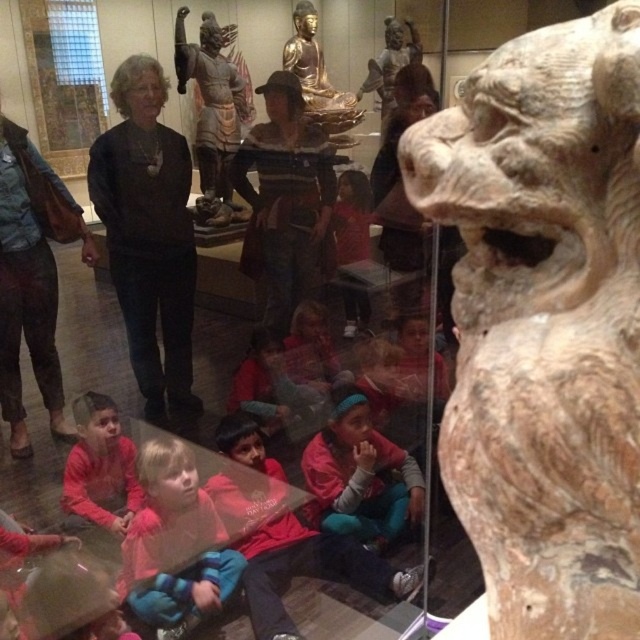
Which is above, pink fabric at center or matte red shirt at lower left?

matte red shirt at lower left is above.

Between point (404, 513) and point (115, 497), which one is positioned in front?

Positioned in front is point (115, 497).

You are a GUI agent. You are given a task and a screenshot of the screen. Output one action in this format:
    pyautogui.click(x=<x>, y=<y>)
    Task: Click on the pink fabric at center
    The image size is (640, 640).
    Given the screenshot: What is the action you would take?
    pyautogui.click(x=358, y=476)

Can you confirm if dark brown sweater at center is taller than light pink fleece jacket at lower center?

Indeed, dark brown sweater at center has a greater height compared to light pink fleece jacket at lower center.

Is dark brown sweater at center thinner than light pink fleece jacket at lower center?

Indeed, dark brown sweater at center has a lesser width compared to light pink fleece jacket at lower center.

Who is more distant from viewer, (92, 152) or (163, 456)?

Positioned behind is point (92, 152).

Image resolution: width=640 pixels, height=640 pixels. I want to click on dark brown sweater at center, so click(x=148, y=234).

Between pink fabric at center and gold metallic statue at upper center, which one appears on the right side from the viewer's perspective?

pink fabric at center

Is point (368, 525) in front of point (230, 193)?

Yes, point (368, 525) is in front of point (230, 193).

Locate an element on the screen. This screenshot has height=640, width=640. pink fabric at center is located at coordinates (358, 476).